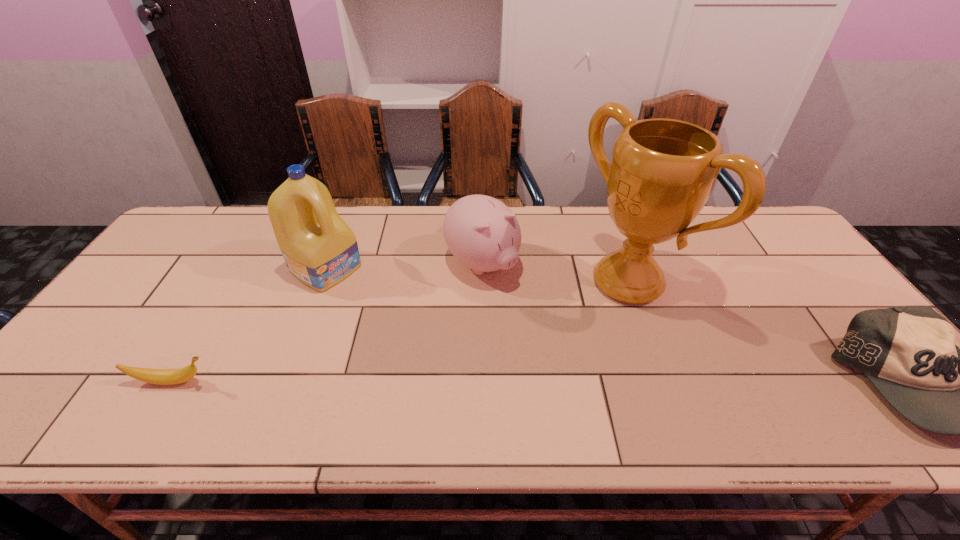
The height and width of the screenshot is (540, 960). I want to click on award that is at the far edge, so click(662, 173).

The height and width of the screenshot is (540, 960). I want to click on object located at the near edge, so click(154, 376).

Locate an element on the screen. Image resolution: width=960 pixels, height=540 pixels. vacant area at the far edge is located at coordinates (269, 215).

You are a GUI agent. You are given a task and a screenshot of the screen. Output one action in this format:
    pyautogui.click(x=<x>, y=<y>)
    Task: Click on the free space at the near edge
    Image resolution: width=960 pixels, height=540 pixels.
    Given the screenshot: What is the action you would take?
    pyautogui.click(x=480, y=374)

Identify the location of blank space at the left edge of the desktop. The image size is (960, 540). (191, 275).

The image size is (960, 540). Identify the location of vacant space at the right edge of the desktop. (757, 267).

Where is `free space at the near left corner`? Image resolution: width=960 pixels, height=540 pixels. free space at the near left corner is located at coordinates (64, 374).

Find the location of a particular element. unoccupied position between the award and the third shortest object is located at coordinates (555, 273).

Identify the location of empty space that is in between the piggy bank and the fourth shortest object. The image size is (960, 540). (404, 266).

Find the location of a particular element. The height and width of the screenshot is (540, 960). free space between the third object from left to right and the tallest object is located at coordinates (555, 273).